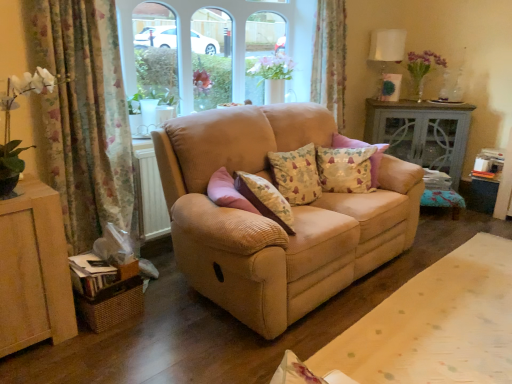
Question: From a real-world perspective, is floral fabric curtain at upper center, placed as the first curtain when sorted from right to left, positioned above or below beige corduroy couch at center?

Choices:
 (A) above
 (B) below

Answer: (A)

Question: In the image, is floral fabric curtain at upper center, which is the 2th curtain in front-to-back order, positioned in front of or behind beige corduroy couch at center?

Choices:
 (A) behind
 (B) front

Answer: (A)

Question: Estimate the real-world distances between objects in this image. Which object is closer to the floral fabric cushion at center, which is counted as the 2th pillow, starting from the right?

Choices:
 (A) white fabric lampshade at upper right
 (B) floral fabric pillow at center, which is counted as the second pillow, starting from the left
 (C) beige fabric sofa at center
 (D) floral fabric curtain at left, arranged as the 2th curtain when viewed from the right
 (E) floral fabric curtain at upper center, which is the first curtain from back to front

Answer: (B)

Question: Based on their relative distances, which object is nearer to the beige fabric sofa at center?

Choices:
 (A) floral fabric pillow at center, the 1th pillow from the right
 (B) floral fabric curtain at upper center, placed as the first curtain when sorted from right to left
 (C) beige corduroy couch at center
 (D) white fabric lampshade at upper right
 (E) matte gray cabinet at right

Answer: (C)